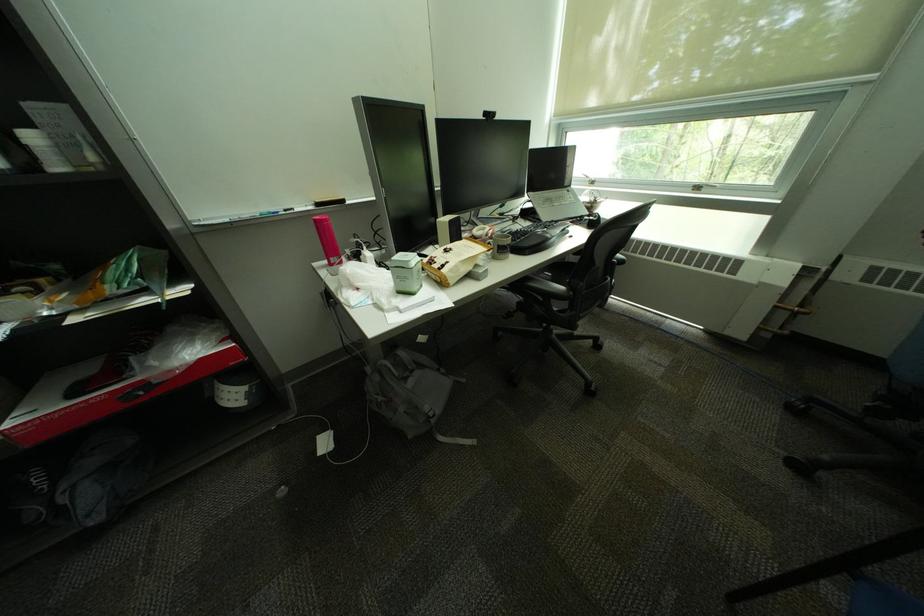
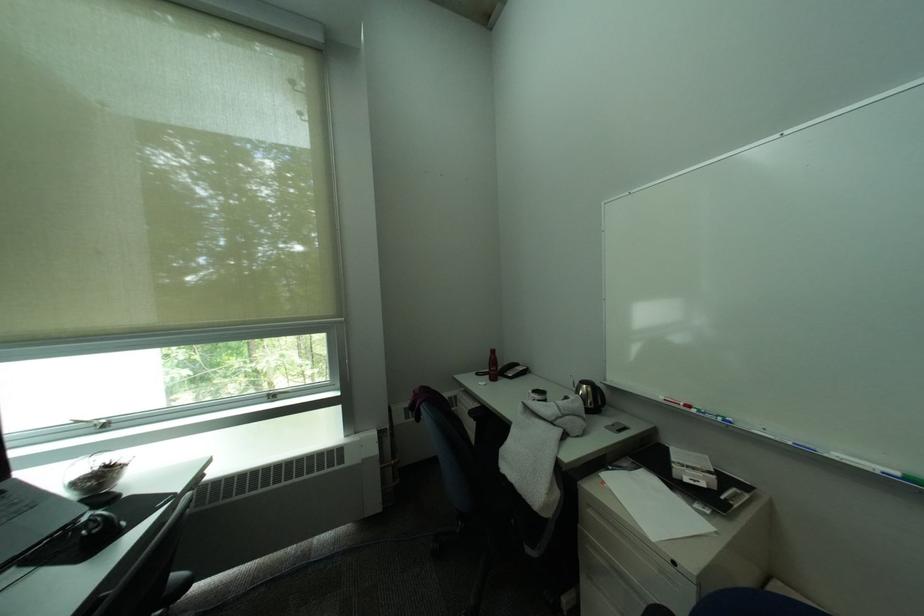
Question: The camera is either moving clockwise (left) or counter-clockwise (right) around the object. The first image is from the beginning of the video and the second image is from the end. Is the camera moving left or right when shooting the video?

Choices:
 (A) Left
 (B) Right

Answer: (A)